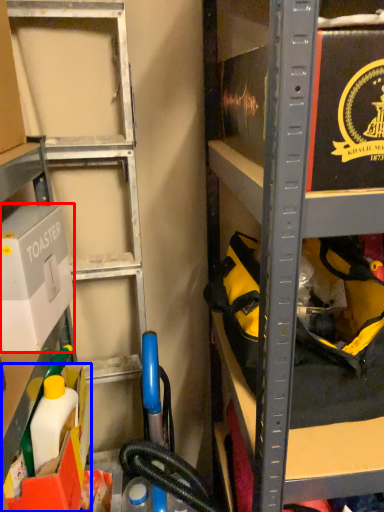
Question: Which object is further to the camera taking this photo, box (highlighted by a red box) or box (highlighted by a blue box)?

Choices:
 (A) box
 (B) box

Answer: (B)